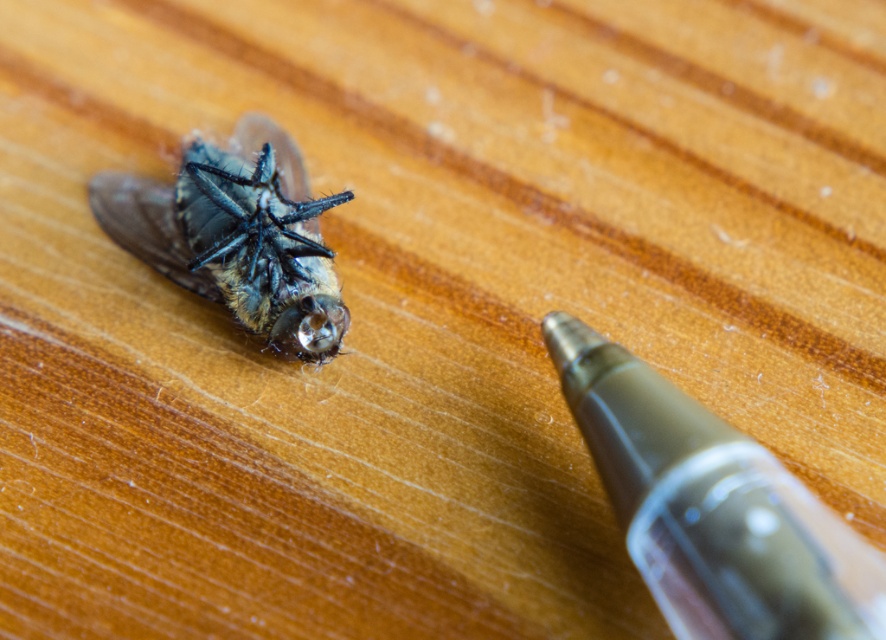
You are an entomologist studying the fly. You need to mark its location on a grid. Where is the transparent plastic pen at lower right located in terms of coordinates?

The transparent plastic pen at lower right is located at coordinates point (711, 508).